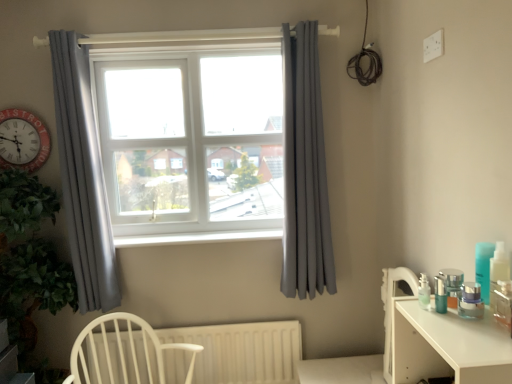
Where is `white plastic window frame at center`? white plastic window frame at center is located at coordinates (191, 140).

Locate an element on the screen. This screenshot has height=384, width=512. red plastic clock at left is located at coordinates (23, 140).

At what (x,y) coordinates should I click in order to perform the action: click on white plastic window sill at center. Please return your answer as a coordinate pair (x, y). The height and width of the screenshot is (384, 512). Looking at the image, I should click on pyautogui.click(x=197, y=237).

Considering the sizes of objects red plastic clock at left and white plastic window sill at center in the image provided, who is wider, red plastic clock at left or white plastic window sill at center?

Wider between the two is white plastic window sill at center.

From the picture: Who is more distant, red plastic clock at left or white plastic window sill at center?

white plastic window sill at center is further from the camera.

From the image's perspective, which one is positioned lower, red plastic clock at left or white plastic window sill at center?

white plastic window sill at center, from the image's perspective.

Considering the sizes of objects red plastic clock at left and white plastic window sill at center in the image provided, who is smaller, red plastic clock at left or white plastic window sill at center?

Smaller between the two is red plastic clock at left.

Can you tell me how much green leafy plant at left and red plastic clock at left differ in facing direction?

They differ by 88 degrees in their facing directions.

Considering the sizes of green leafy plant at left and red plastic clock at left in the image, is green leafy plant at left taller or shorter than red plastic clock at left?

Considering their sizes, green leafy plant at left has more height than red plastic clock at left.

Is red plastic clock at left at the back of green leafy plant at left?

No.

Do you think green leafy plant at left is within red plastic clock at left, or outside of it?

green leafy plant at left exists outside the volume of red plastic clock at left.

From the picture: Is red plastic clock at left not inside white matte drawer at lower right?

Yes, red plastic clock at left is outside of white matte drawer at lower right.

In the scene shown: Which of these two, red plastic clock at left or white matte drawer at lower right, is bigger?

red plastic clock at left.

Which object is positioned more to the left, red plastic clock at left or white matte drawer at lower right?

red plastic clock at left is more to the left.

From the picture: Are red plastic clock at left and white matte drawer at lower right located far from each other?

Indeed, red plastic clock at left is not near white matte drawer at lower right.

From the image's perspective, is gray fabric curtain at right, which is counted as the first curtain, starting from the right, beneath gray fabric curtain at upper left, which ranks as the 2th curtain in right-to-left order?

No.

Identify the location of curtain above the gray fabric curtain at upper left, the 1th curtain from the left (from the image's perspective). Image resolution: width=512 pixels, height=384 pixels. (305, 170).

Which is in front, point (287, 285) or point (100, 193)?

The point (100, 193) is closer.

Is the position of white plastic window frame at center less distant than that of white matte drawer at lower right?

No, white plastic window frame at center is behind white matte drawer at lower right.

Identify the location of drawer below the white plastic window frame at center (from the image's perspective). Image resolution: width=512 pixels, height=384 pixels. (414, 354).

Is point (129, 240) farther from viewer compared to point (116, 379)?

Yes, point (129, 240) is behind point (116, 379).

From a real-world perspective, is white plastic window sill at center under white matte radiator at lower center?

Actually, white plastic window sill at center is physically above white matte radiator at lower center in the real world.

Is white plastic window sill at center to the right of white matte radiator at lower center from the viewer's perspective?

Correct, you'll find white plastic window sill at center to the right of white matte radiator at lower center.

Is white plastic window sill at center in front of white matte radiator at lower center?

No, white plastic window sill at center is behind white matte radiator at lower center.

Is white matte drawer at lower right located within white matte radiator at lower center?

No, white matte drawer at lower right is not a part of white matte radiator at lower center.

From the image's perspective, is white matte radiator at lower center on top of white matte drawer at lower right?

No.

Find the location of a particular element. Image resolution: width=512 pixels, height=384 pixels. drawer above the white matte radiator at lower center (from the image's perspective) is located at coordinates (414, 354).

Is the depth of white matte radiator at lower center greater than that of white matte drawer at lower right?

Yes, white matte radiator at lower center is behind white matte drawer at lower right.

Locate an element on the screen. window sill behind the red plastic clock at left is located at coordinates (197, 237).

You are a GUI agent. You are given a task and a screenshot of the screen. Output one action in this format:
    pyautogui.click(x=<x>, y=<y>)
    Task: Click on the plant below the red plastic clock at left (from a real-world perspective)
    The image size is (512, 384).
    Given the screenshot: What is the action you would take?
    pyautogui.click(x=29, y=262)

Based on the photo, when comparing their distances from white matte radiator at lower center, does white plastic window frame at center or white matte drawer at lower right seem closer?

white plastic window frame at center is positioned closer to the anchor white matte radiator at lower center.

From the image, which object appears to be farther from gray fabric curtain at upper left, the 1th curtain from the left, white plastic window sill at center or white wood chair at lower left?

white plastic window sill at center is further to gray fabric curtain at upper left, the 1th curtain from the left.

Looking at this image, looking at the image, which one is located further to green leafy plant at left, gray fabric curtain at upper left, the 1th curtain from the left, or gray fabric curtain at right, which is counted as the first curtain, starting from the right?

gray fabric curtain at right, which is counted as the first curtain, starting from the right, is further to green leafy plant at left.

Estimate the real-world distances between objects in this image. Which object is closer to white matte radiator at lower center, white matte drawer at lower right or white plastic window sill at center?

white plastic window sill at center.

From the image, which object appears to be farther from gray fabric curtain at right, which is counted as the first curtain, starting from the right, white plastic window sill at center or gray fabric curtain at upper left, the 1th curtain from the left?

gray fabric curtain at upper left, the 1th curtain from the left.

Considering their positions, is white matte drawer at lower right positioned closer to red plastic clock at left than gray fabric curtain at upper left, which ranks as the 2th curtain in right-to-left order?

Based on the image, gray fabric curtain at upper left, which ranks as the 2th curtain in right-to-left order, appears to be nearer to red plastic clock at left.

Estimate the real-world distances between objects in this image. Which object is closer to red plastic clock at left, white matte drawer at lower right or white plastic window frame at center?

white plastic window frame at center is positioned closer to the anchor red plastic clock at left.

When comparing their distances from gray fabric curtain at upper left, the 1th curtain from the left, does white plastic window frame at center or white wood chair at lower left seem further?

Among the two, white plastic window frame at center is located further to gray fabric curtain at upper left, the 1th curtain from the left.

Locate an element on the screen. Image resolution: width=512 pixels, height=384 pixels. window frame between green leafy plant at left and white matte drawer at lower right is located at coordinates (191, 140).

Locate an element on the screen. This screenshot has height=384, width=512. plant between red plastic clock at left and white plastic window sill at center from left to right is located at coordinates (29, 262).

Find the location of `radiator located between red plastic clock at left and gray fabric curtain at right, the second curtain from the left, in the left-right direction`. radiator located between red plastic clock at left and gray fabric curtain at right, the second curtain from the left, in the left-right direction is located at coordinates (242, 351).

Where is `radiator located between green leafy plant at left and white matte drawer at lower right in the left-right direction`? radiator located between green leafy plant at left and white matte drawer at lower right in the left-right direction is located at coordinates (242, 351).